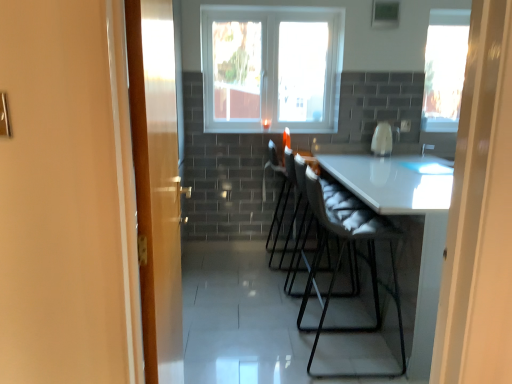
Where is `free spot to the left of white fabric chair at center, which ranks as the 1th chair in back-to-front order`? The width and height of the screenshot is (512, 384). free spot to the left of white fabric chair at center, which ranks as the 1th chair in back-to-front order is located at coordinates (244, 261).